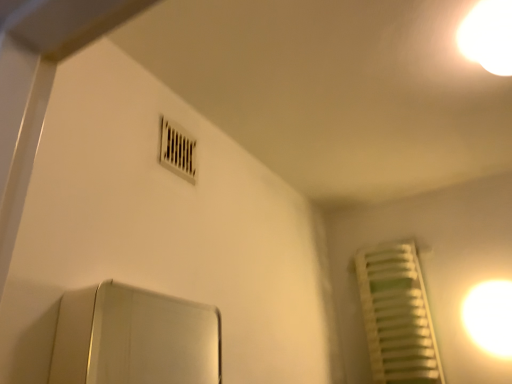
What do you see at coordinates (488, 36) in the screenshot?
I see `white glossy light bulb at upper right, arranged as the first light when viewed from the front` at bounding box center [488, 36].

Find the location of a particular element. This screenshot has height=384, width=512. white plastic air conditioning at upper center is located at coordinates (178, 150).

You are a GUI agent. You are given a task and a screenshot of the screen. Output one action in this format:
    pyautogui.click(x=<x>, y=<y>)
    Task: Click on the white glossy light at upper right, the first light when ordered from right to left
    
    Given the screenshot: What is the action you would take?
    pyautogui.click(x=490, y=316)

The width and height of the screenshot is (512, 384). In order to click on white glossy light bulb at upper right, arranged as the first light when viewed from the front in this screenshot , I will do point(488,36).

Consider the image. Is white glossy light bulb at upper right, which is the second light from bottom to top, taller than white plastic air conditioning at upper center?

No.

Is white glossy light bulb at upper right, which is the second light from bottom to top, bigger than white plastic air conditioning at upper center?

Yes.

Could you measure the distance between white glossy light bulb at upper right, the 2th light from the right, and white plastic air conditioning at upper center?

They are 37.19 inches apart.

Could you tell me if white glossy light bulb at upper right, arranged as the first light when viewed from the front, is turned towards white plastic air conditioning at upper center?

No, white glossy light bulb at upper right, arranged as the first light when viewed from the front, is not aimed at white plastic air conditioning at upper center.

Is white glossy light at upper right, acting as the 2th light starting from the left, not within white matte radiator at right?

Yes.

Measure the distance from white glossy light at upper right, acting as the 2th light starting from the left, to white matte radiator at right.

They are 11.23 inches apart.

Looking at their sizes, would you say white glossy light at upper right, the 2th light when ordered from top to bottom, is wider or thinner than white matte radiator at right?

Clearly, white glossy light at upper right, the 2th light when ordered from top to bottom, has less width compared to white matte radiator at right.

Is white glossy light at upper right, the 2th light when ordered from top to bottom, turned away from white matte radiator at right?

white glossy light at upper right, the 2th light when ordered from top to bottom, is not turned away from white matte radiator at right.

From a real-world perspective, is white glossy light bulb at upper right, which is the second light from bottom to top, beneath white matte radiator at right?

Incorrect, from a real-world perspective, white glossy light bulb at upper right, which is the second light from bottom to top, is higher than white matte radiator at right.

At what (x,y) coordinates should I click in order to perform the action: click on radiator that is below the white glossy light bulb at upper right, marked as the 1th light in a top-to-bottom arrangement (from the image's perspective). Please return your answer as a coordinate pair (x, y). Looking at the image, I should click on (397, 315).

Which of these two, white glossy light bulb at upper right, which is the second light from bottom to top, or white matte radiator at right, stands taller?

white matte radiator at right.

Does point (463, 54) appear closer or farther from the camera than point (400, 275)?

Clearly, point (463, 54) is closer to the camera than point (400, 275).

Which object is wider, white matte radiator at right or white plastic air conditioning at upper center?

white matte radiator at right is wider.

Is there a large distance between white matte radiator at right and white plastic air conditioning at upper center?

Yes, white matte radiator at right and white plastic air conditioning at upper center are located far from each other.

From a real-world perspective, is white matte radiator at right on top of white plastic air conditioning at upper center?

No, from a real-world perspective, white matte radiator at right is not over white plastic air conditioning at upper center

Can you tell me how much white matte radiator at right and white plastic air conditioning at upper center differ in facing direction?

The facing directions of white matte radiator at right and white plastic air conditioning at upper center are 90 degrees apart.

From the image's perspective, between white plastic air conditioning at upper center and white glossy light bulb at upper right, the 2th light from the right, which one is located above?

white glossy light bulb at upper right, the 2th light from the right.

Based on the photo, which object is further away from the camera, white plastic air conditioning at upper center or white glossy light bulb at upper right, arranged as the first light when viewed from the front?

Positioned behind is white plastic air conditioning at upper center.

Considering the positions of objects white plastic air conditioning at upper center and white glossy light bulb at upper right, arranged as the 1th light when viewed from the left, in the image provided, who is more to the right, white plastic air conditioning at upper center or white glossy light bulb at upper right, arranged as the 1th light when viewed from the left,?

white glossy light bulb at upper right, arranged as the 1th light when viewed from the left, is more to the right.

Is white glossy light bulb at upper right, arranged as the 1th light when viewed from the left, located within white plastic air conditioning at upper center?

No, white glossy light bulb at upper right, arranged as the 1th light when viewed from the left, is not a part of white plastic air conditioning at upper center.

Is white glossy light at upper right, the 2th light when ordered from top to bottom, next to white glossy light bulb at upper right, marked as the 1th light in a top-to-bottom arrangement?

No, white glossy light at upper right, the 2th light when ordered from top to bottom, is not beside white glossy light bulb at upper right, marked as the 1th light in a top-to-bottom arrangement.

Does white glossy light at upper right, acting as the 2th light starting from the left, have a larger size compared to white glossy light bulb at upper right, acting as the 2th light starting from the back?

No, white glossy light at upper right, acting as the 2th light starting from the left, is not bigger than white glossy light bulb at upper right, acting as the 2th light starting from the back.

Can you confirm if white glossy light at upper right, acting as the 2th light starting from the left, is positioned to the left of white glossy light bulb at upper right, the 2th light from the right?

In fact, white glossy light at upper right, acting as the 2th light starting from the left, is to the right of white glossy light bulb at upper right, the 2th light from the right.

Which is more to the right, white plastic air conditioning at upper center or white matte radiator at right?

Positioned to the right is white matte radiator at right.

Is white plastic air conditioning at upper center facing away from white matte radiator at right?

white plastic air conditioning at upper center does not have its back to white matte radiator at right.

Can you confirm if white plastic air conditioning at upper center is shorter than white matte radiator at right?

Yes, white plastic air conditioning at upper center is shorter than white matte radiator at right.

Where is `air conditioning located on the left of white glossy light bulb at upper right, arranged as the first light when viewed from the front`? The height and width of the screenshot is (384, 512). air conditioning located on the left of white glossy light bulb at upper right, arranged as the first light when viewed from the front is located at coordinates (178, 150).

Where is `light beneath the white matte radiator at right (from a real-world perspective)`? This screenshot has width=512, height=384. light beneath the white matte radiator at right (from a real-world perspective) is located at coordinates (490, 316).

When comparing their distances from white glossy light bulb at upper right, the 2th light from the right, does white plastic air conditioning at upper center or white glossy light at upper right, which is the first light in bottom-to-top order, seem closer?

white plastic air conditioning at upper center is positioned closer to the anchor white glossy light bulb at upper right, the 2th light from the right.

From the image, which object appears to be farther from white glossy light at upper right, the 2th light when ordered from top to bottom, white plastic air conditioning at upper center or white glossy light bulb at upper right, arranged as the 1th light when viewed from the left?

white plastic air conditioning at upper center is further to white glossy light at upper right, the 2th light when ordered from top to bottom.

Estimate the real-world distances between objects in this image. Which object is closer to white plastic air conditioning at upper center, white matte radiator at right or white glossy light bulb at upper right, the 2th light from the right?

Among the two, white glossy light bulb at upper right, the 2th light from the right, is located nearer to white plastic air conditioning at upper center.

When comparing their distances from white plastic air conditioning at upper center, does white matte radiator at right or white glossy light at upper right, the 2th light when ordered from top to bottom, seem closer?

white matte radiator at right is closer to white plastic air conditioning at upper center.

Based on their spatial positions, is white matte radiator at right or white plastic air conditioning at upper center closer to white glossy light at upper right, the 2th light when ordered from top to bottom?

white matte radiator at right.

Which object lies further to the anchor point white glossy light bulb at upper right, the 2th light from the right, white glossy light at upper right, the 2th light when ordered from top to bottom, or white matte radiator at right?

white matte radiator at right is positioned further to the anchor white glossy light bulb at upper right, the 2th light from the right.

Estimate the real-world distances between objects in this image. Which object is closer to white matte radiator at right, white plastic air conditioning at upper center or white glossy light bulb at upper right, the 2th light from the right?

white glossy light bulb at upper right, the 2th light from the right.

Based on their spatial positions, is white glossy light bulb at upper right, which is the second light from bottom to top, or white plastic air conditioning at upper center closer to white glossy light at upper right, acting as the 2th light starting from the left?

Among the two, white glossy light bulb at upper right, which is the second light from bottom to top, is located nearer to white glossy light at upper right, acting as the 2th light starting from the left.

Image resolution: width=512 pixels, height=384 pixels. In order to click on radiator between white plastic air conditioning at upper center and white glossy light at upper right, the first light when ordered from right to left, in the horizontal direction in this screenshot , I will do `click(397, 315)`.

Locate an element on the screen. light between white glossy light bulb at upper right, the 2th light from the right, and white matte radiator at right from top to bottom is located at coordinates (490, 316).

Identify the location of radiator between white plastic air conditioning at upper center and white glossy light bulb at upper right, which is the second light from bottom to top. This screenshot has width=512, height=384. (397, 315).

Locate an element on the screen. Image resolution: width=512 pixels, height=384 pixels. light between white plastic air conditioning at upper center and white glossy light at upper right, acting as the 2th light starting from the left is located at coordinates (488, 36).